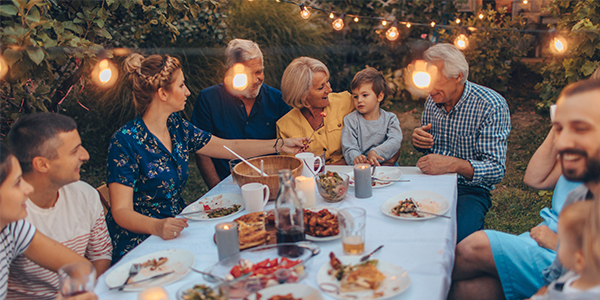
I want to click on plates, so click(x=370, y=284), click(x=416, y=208), click(x=373, y=174), click(x=226, y=204), click(x=167, y=268).